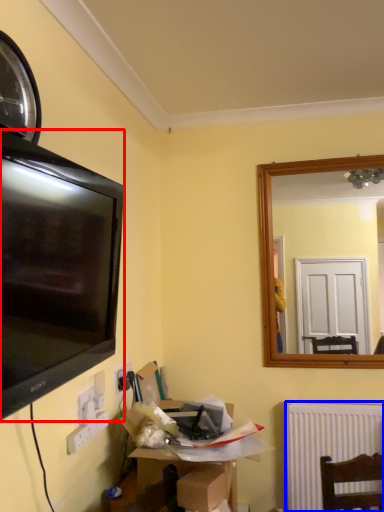
Question: Which of the following is the farthest to the observer, television (highlighted by a red box) or radiator (highlighted by a blue box)?

Choices:
 (A) television
 (B) radiator

Answer: (B)